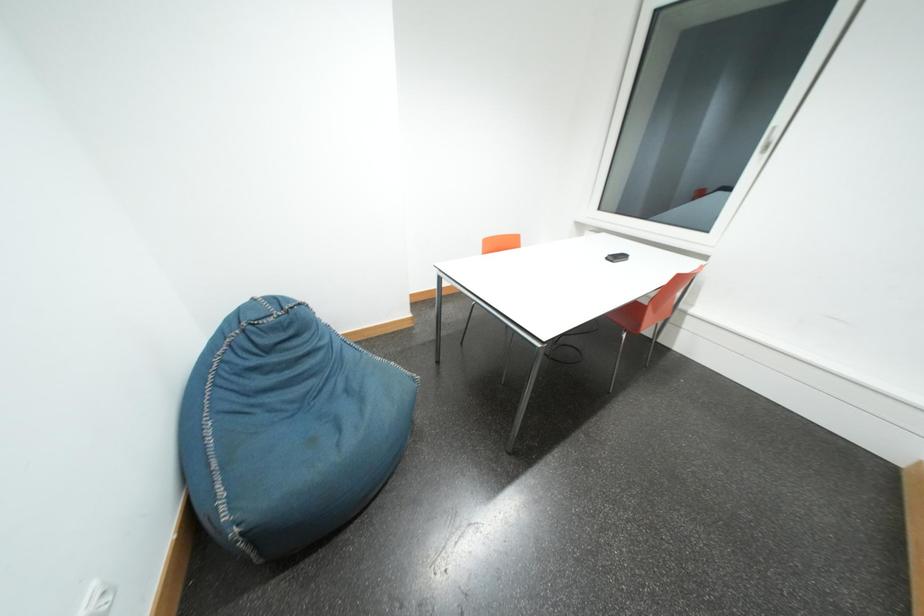
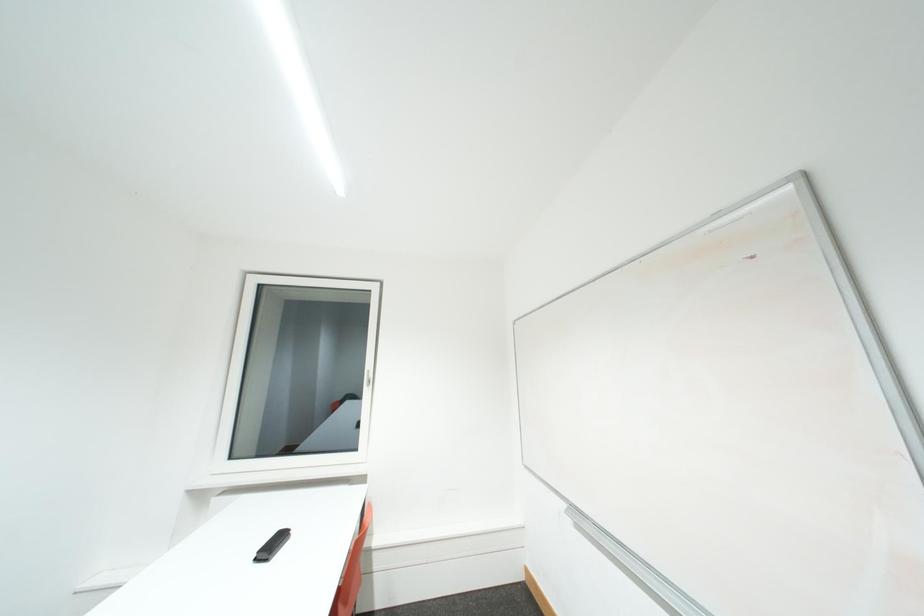
How did the camera likely rotate?

The camera rotated toward right-up.